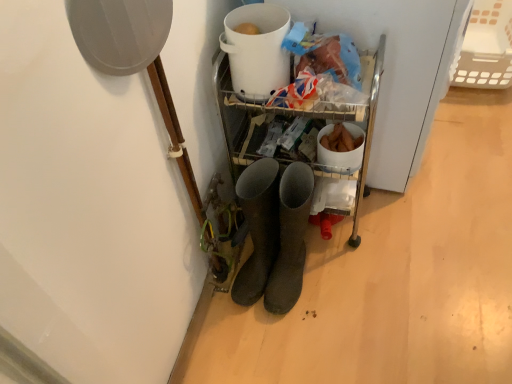
Question: Is white plastic basket at upper right bigger than dark gray rubber boots at center?

Choices:
 (A) yes
 (B) no

Answer: (A)

Question: From a real-world perspective, is white plastic basket at upper right positioned under dark gray rubber boots at center based on gravity?

Choices:
 (A) no
 (B) yes

Answer: (B)

Question: Is dark gray rubber boots at center a part of white plastic basket at upper right?

Choices:
 (A) no
 (B) yes

Answer: (A)

Question: Is white plastic basket at upper right behind dark gray rubber boots at center?

Choices:
 (A) yes
 (B) no

Answer: (A)

Question: From the image's perspective, is white plastic basket at upper right above dark gray rubber boots at center?

Choices:
 (A) yes
 (B) no

Answer: (A)

Question: Relative to white plastic bucket at upper center, is white plastic basket at upper right in front or behind?

Choices:
 (A) behind
 (B) front

Answer: (A)

Question: Is white plastic basket at upper right inside the boundaries of white plastic bucket at upper center, or outside?

Choices:
 (A) outside
 (B) inside

Answer: (A)

Question: Does point (452, 81) appear closer or farther from the camera than point (283, 54)?

Choices:
 (A) farther
 (B) closer

Answer: (A)

Question: Is white plastic basket at upper right taller or shorter than white plastic bucket at upper center?

Choices:
 (A) tall
 (B) short

Answer: (A)

Question: From their relative heights in the image, would you say dark gray rubber boots at center is taller or shorter than white plastic basket at upper right?

Choices:
 (A) short
 (B) tall

Answer: (B)

Question: From a real-world perspective, is dark gray rubber boots at center physically located above or below white plastic basket at upper right?

Choices:
 (A) above
 (B) below

Answer: (A)

Question: Is point (280, 240) closer or farther from the camera than point (466, 46)?

Choices:
 (A) farther
 (B) closer

Answer: (B)

Question: In the image, is dark gray rubber boots at center positioned in front of or behind white plastic basket at upper right?

Choices:
 (A) behind
 (B) front

Answer: (B)

Question: In the image, is dark gray rubber boots at center on the left side or the right side of white plastic bucket at upper center?

Choices:
 (A) left
 (B) right

Answer: (B)

Question: From a real-world perspective, is dark gray rubber boots at center above or below white plastic bucket at upper center?

Choices:
 (A) below
 (B) above

Answer: (A)